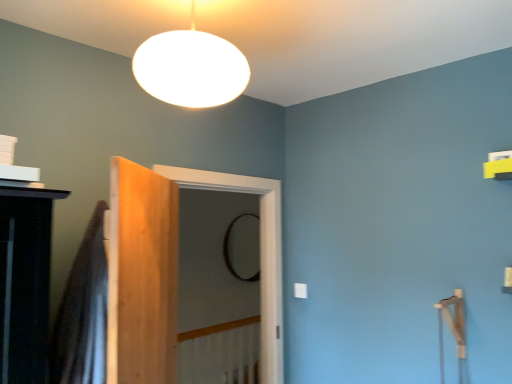
Identify the location of translucent fabric shower curtain at left. (83, 313).

This screenshot has width=512, height=384. Describe the element at coordinates (83, 313) in the screenshot. I see `translucent fabric shower curtain at left` at that location.

Find the location of `white matte/soft lampshade at upper center`. white matte/soft lampshade at upper center is located at coordinates (191, 68).

Locate an element on the screen. Image resolution: width=512 pixels, height=384 pixels. clear glass screen door at center is located at coordinates (216, 259).

The height and width of the screenshot is (384, 512). What do you see at coordinates (142, 275) in the screenshot?
I see `light brown wood door at center` at bounding box center [142, 275].

Find the location of `translucent fabric shower curtain at left`. translucent fabric shower curtain at left is located at coordinates (83, 313).

Considering the sizes of objects clear glass screen door at center and light brown wood door at center in the image provided, who is smaller, clear glass screen door at center or light brown wood door at center?

light brown wood door at center is smaller.

From the image's perspective, is clear glass screen door at center located above or below light brown wood door at center?

clear glass screen door at center is situated lower than light brown wood door at center in the image.

Considering the points (216, 314) and (152, 313), which point is in front, point (216, 314) or point (152, 313)?

The point (152, 313) is more forward.

In the image, is light brown wood door at center positioned in front of or behind translucent fabric shower curtain at left?

Clearly, light brown wood door at center is behind translucent fabric shower curtain at left.

Considering the relative sizes of light brown wood door at center and translucent fabric shower curtain at left in the image provided, is light brown wood door at center thinner than translucent fabric shower curtain at left?

Result: Yes, light brown wood door at center is thinner than translucent fabric shower curtain at left.

Can you confirm if light brown wood door at center is shorter than translucent fabric shower curtain at left?

Incorrect, the height of light brown wood door at center does not fall short of that of translucent fabric shower curtain at left.

How far apart are light brown wood door at center and white matte/soft lampshade at upper center?

The distance of light brown wood door at center from white matte/soft lampshade at upper center is 19.24 inches.

Is light brown wood door at center far away from white matte/soft lampshade at upper center?

That's not correct — light brown wood door at center is a little close to white matte/soft lampshade at upper center.

Does light brown wood door at center appear on the left side of white matte/soft lampshade at upper center?

Correct, you'll find light brown wood door at center to the left of white matte/soft lampshade at upper center.

Does light brown wood door at center have a greater height compared to white matte/soft lampshade at upper center?

Indeed, light brown wood door at center has a greater height compared to white matte/soft lampshade at upper center.

Is black glass mirror at center far away from light brown wood door at center?

Yes, black glass mirror at center and light brown wood door at center are located far from each other.

Considering the positions of objects black glass mirror at center and light brown wood door at center in the image provided, who is in front, black glass mirror at center or light brown wood door at center?

light brown wood door at center is more forward.

Does black glass mirror at center have a greater width compared to light brown wood door at center?

In fact, black glass mirror at center might be narrower than light brown wood door at center.

Does point (232, 223) appear closer or farther from the camera than point (149, 284)?

Point (232, 223) appears to be farther away from the viewer than point (149, 284).

What's the angular difference between translucent fabric shower curtain at left and light brown wood door at center's facing directions?

90 degrees.

Is point (85, 363) closer to camera compared to point (137, 255)?

That is True.

Is the position of translucent fabric shower curtain at left more distant than that of light brown wood door at center?

No, translucent fabric shower curtain at left is in front of light brown wood door at center.

Which is behind, clear glass screen door at center or black glass mirror at center?

Positioned behind is black glass mirror at center.

Where is `screen door beneath the black glass mirror at center (from a real-world perspective)`? The width and height of the screenshot is (512, 384). screen door beneath the black glass mirror at center (from a real-world perspective) is located at coordinates click(216, 259).

Measure the distance from clear glass screen door at center to black glass mirror at center.

clear glass screen door at center is 11.37 inches away from black glass mirror at center.

Is the surface of clear glass screen door at center in direct contact with black glass mirror at center?

No, clear glass screen door at center is not with black glass mirror at center.

Which is more to the left, white matte/soft lampshade at upper center or black glass mirror at center?

white matte/soft lampshade at upper center is more to the left.

How distant is white matte/soft lampshade at upper center from black glass mirror at center?

A distance of 3.59 meters exists between white matte/soft lampshade at upper center and black glass mirror at center.

Is white matte/soft lampshade at upper center thinner than black glass mirror at center?

No, white matte/soft lampshade at upper center is not thinner than black glass mirror at center.

Locate an element on the screen. The image size is (512, 384). mirror below the white matte/soft lampshade at upper center (from a real-world perspective) is located at coordinates (228, 251).

Identify the location of screen door that appears below the light brown wood door at center (from the image's perspective). The image size is (512, 384). (216, 259).

You are a GUI agent. You are given a task and a screenshot of the screen. Output one action in this format:
    pyautogui.click(x=<x>, y=<y>)
    Task: Click on the door located behind the translucent fabric shower curtain at left
    The height and width of the screenshot is (384, 512).
    Given the screenshot: What is the action you would take?
    pyautogui.click(x=142, y=275)

Considering their positions, is white matte/soft lampshade at upper center positioned closer to black glass mirror at center than translucent fabric shower curtain at left?

translucent fabric shower curtain at left.

Which object lies nearer to the anchor point black glass mirror at center, light brown wood door at center or clear glass screen door at center?

Based on the image, clear glass screen door at center appears to be nearer to black glass mirror at center.

Which object lies further to the anchor point light brown wood door at center, black glass mirror at center or clear glass screen door at center?

black glass mirror at center.

Which object lies further to the anchor point clear glass screen door at center, white matte/soft lampshade at upper center or translucent fabric shower curtain at left?

The object further to clear glass screen door at center is white matte/soft lampshade at upper center.

Based on their spatial positions, is black glass mirror at center or light brown wood door at center closer to translucent fabric shower curtain at left?

light brown wood door at center.

Considering their positions, is clear glass screen door at center positioned further to black glass mirror at center than light brown wood door at center?

Based on the image, light brown wood door at center appears to be further to black glass mirror at center.

Based on the photo, based on their spatial positions, is light brown wood door at center or white matte/soft lampshade at upper center further from translucent fabric shower curtain at left?

The object further to translucent fabric shower curtain at left is white matte/soft lampshade at upper center.

Based on their spatial positions, is white matte/soft lampshade at upper center or light brown wood door at center further from clear glass screen door at center?

white matte/soft lampshade at upper center.

At what (x,y) coordinates should I click in order to perform the action: click on screen door located between translucent fabric shower curtain at left and black glass mirror at center in the depth direction. Please return your answer as a coordinate pair (x, y). This screenshot has width=512, height=384. Looking at the image, I should click on (216, 259).

At what (x,y) coordinates should I click in order to perform the action: click on door between white matte/soft lampshade at upper center and black glass mirror at center along the z-axis. Please return your answer as a coordinate pair (x, y). The height and width of the screenshot is (384, 512). Looking at the image, I should click on (142, 275).

Where is `shower curtain between white matte/soft lampshade at upper center and black glass mirror at center along the z-axis`? This screenshot has height=384, width=512. shower curtain between white matte/soft lampshade at upper center and black glass mirror at center along the z-axis is located at coordinates (83, 313).

Identify the location of screen door positioned between white matte/soft lampshade at upper center and black glass mirror at center from near to far. The image size is (512, 384). (216, 259).